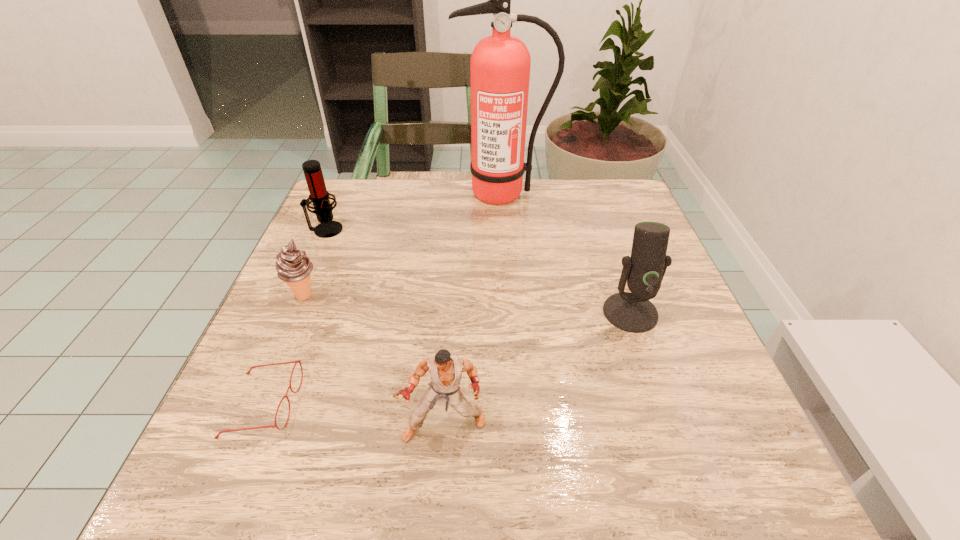
Locate an element on the screen. free space between the shortest object and the puncher is located at coordinates (354, 415).

You are a GUI agent. You are given a task and a screenshot of the screen. Output one action in this format:
    pyautogui.click(x=<x>, y=<y>)
    Task: Click on the blank region between the shortest object and the icecream
    The width and height of the screenshot is (960, 540).
    Given the screenshot: What is the action you would take?
    pyautogui.click(x=284, y=350)

Where is `vacant space in between the shortest object and the puncher`? vacant space in between the shortest object and the puncher is located at coordinates (354, 415).

The width and height of the screenshot is (960, 540). Identify the location of unoccupied area between the rightmost object and the farther microphone. (478, 271).

The height and width of the screenshot is (540, 960). I want to click on vacant area between the shortest object and the fifth nearest object, so click(x=295, y=317).

Image resolution: width=960 pixels, height=540 pixels. In order to click on vacant space that's between the puncher and the right microphone in this screenshot , I will do `click(538, 369)`.

Find the location of a particular element. This screenshot has height=540, width=960. unoccupied position between the fifth tallest object and the left microphone is located at coordinates (315, 262).

At what (x,y) coordinates should I click in order to perform the action: click on vacant space that's between the puncher and the farthest object. Please return your answer as a coordinate pair (x, y). The image size is (960, 540). Looking at the image, I should click on (473, 310).

This screenshot has height=540, width=960. Find the location of `free space between the spectacles and the puncher`. free space between the spectacles and the puncher is located at coordinates (354, 415).

Identify the location of empty space between the second farthest object and the fifth tallest object. This screenshot has height=540, width=960. (315, 262).